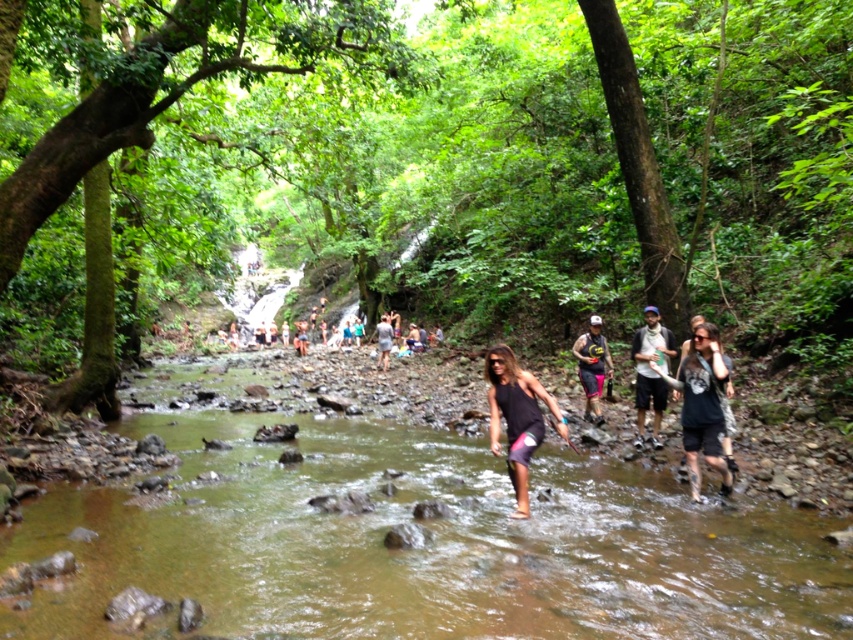
The image size is (853, 640). In order to click on green leafy forest at center in this screenshot , I will do `click(508, 150)`.

Is green leafy forest at center shorter than clear water at center?

Incorrect, green leafy forest at center's height does not fall short of clear water at center's.

Is point (106, 115) closer to camera compared to point (160, 545)?

That is False.

Find the location of a particular element. This screenshot has height=640, width=853. green leafy forest at center is located at coordinates (508, 150).

Who is positioned more to the right, matte gray shirt at center or light brown fabric shorts at center?

matte gray shirt at center is more to the right.

Between matte gray shirt at center and light brown fabric shorts at center, which one appears on the left side from the viewer's perspective?

light brown fabric shorts at center

The width and height of the screenshot is (853, 640). Find the location of `matte gray shirt at center`. matte gray shirt at center is located at coordinates (651, 371).

Does dark gray cotton t-shirt at center appear under light brown fabric shorts at center?

Yes.

Which is more to the left, dark gray cotton t-shirt at center or light brown fabric shorts at center?

From the viewer's perspective, light brown fabric shorts at center appears more on the left side.

The width and height of the screenshot is (853, 640). What do you see at coordinates (701, 404) in the screenshot?
I see `dark gray cotton t-shirt at center` at bounding box center [701, 404].

In order to click on dark gray cotton t-shirt at center in this screenshot , I will do `click(701, 404)`.